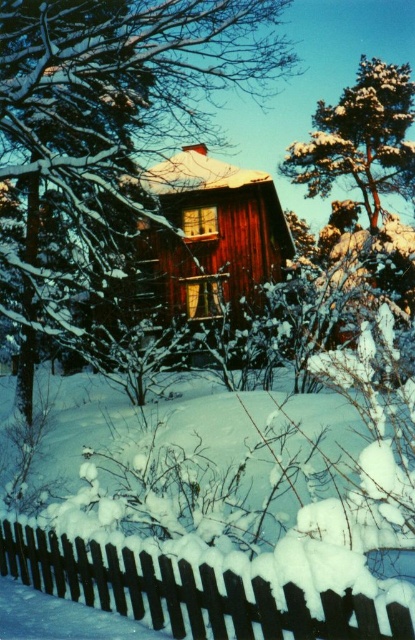
Question: Is smooth wooden house at center closer to camera compared to snow-covered pine tree at upper right?

Choices:
 (A) yes
 (B) no

Answer: (A)

Question: Which point is closer to the camera taking this photo?

Choices:
 (A) (344, 173)
 (B) (92, 264)

Answer: (B)

Question: Which point is closer to the camera taking this photo?

Choices:
 (A) (254, 282)
 (B) (229, 605)
 (C) (397, 100)
 (D) (4, 58)

Answer: (B)

Question: Which of these objects is positioned farthest from the snow-covered wooden fence at lower center?

Choices:
 (A) snow-covered pine tree at upper right
 (B) smooth wooden cabin at center
 (C) smooth wooden house at center

Answer: (A)

Question: Is smooth wooden house at center wider than smooth wooden cabin at center?

Choices:
 (A) no
 (B) yes

Answer: (B)

Question: Considering the relative positions of snow-covered wooden fence at lower center and snow-covered pine tree at upper right in the image provided, where is snow-covered wooden fence at lower center located with respect to snow-covered pine tree at upper right?

Choices:
 (A) above
 (B) below

Answer: (B)